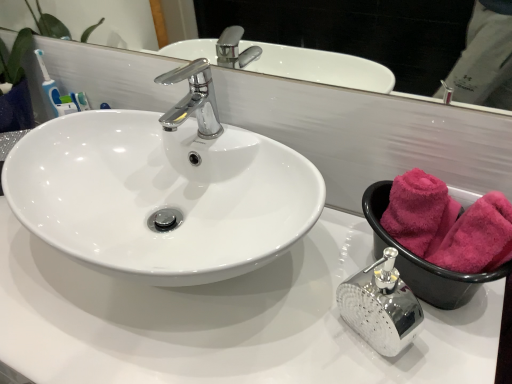
Locate an element on the screen. free spot in front of pink soft towel at right is located at coordinates (437, 350).